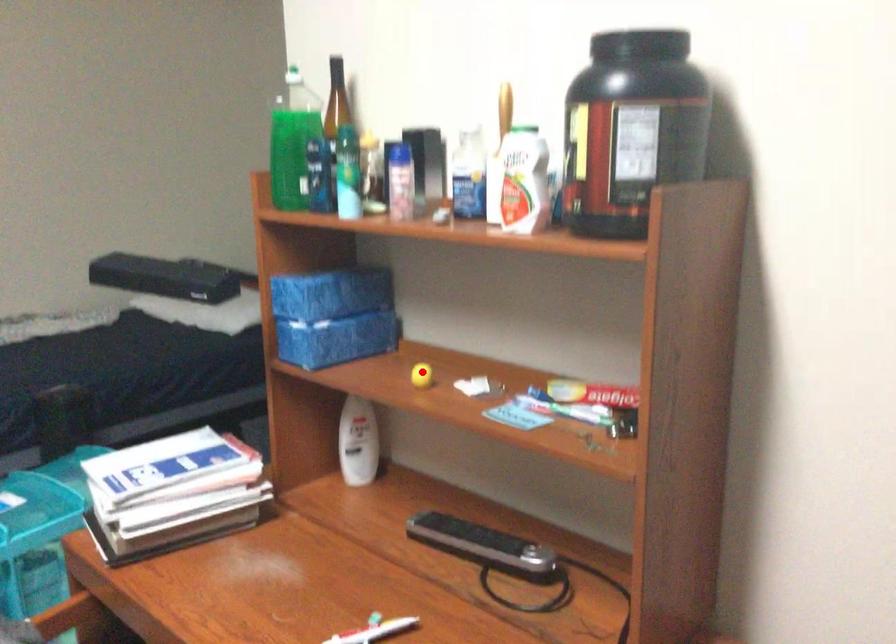
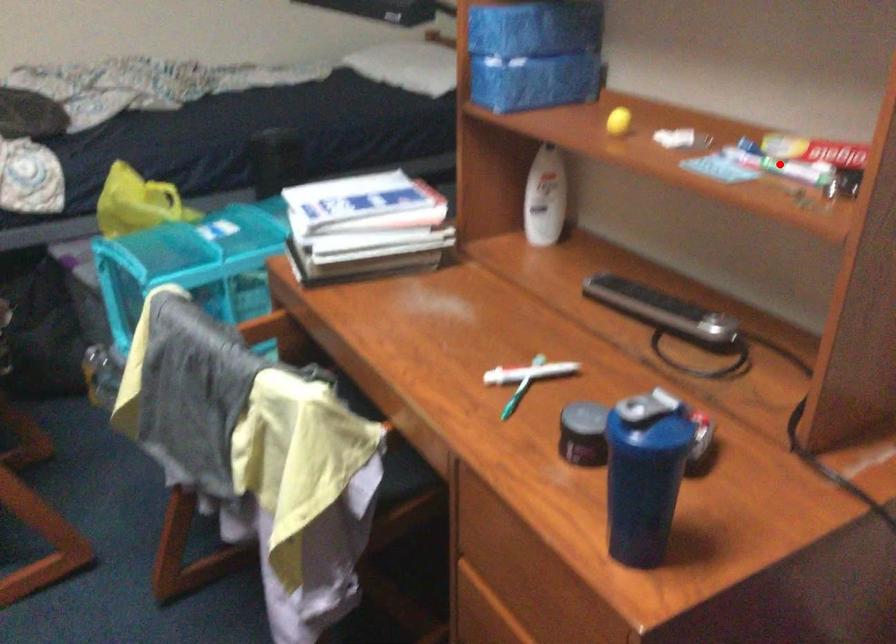
I am providing you with two images of the same scene from different viewpoints. A red point is marked on the first image and another point is marked on the second image. Are the points marked in image1 and image2 representing the same 3D position?

No